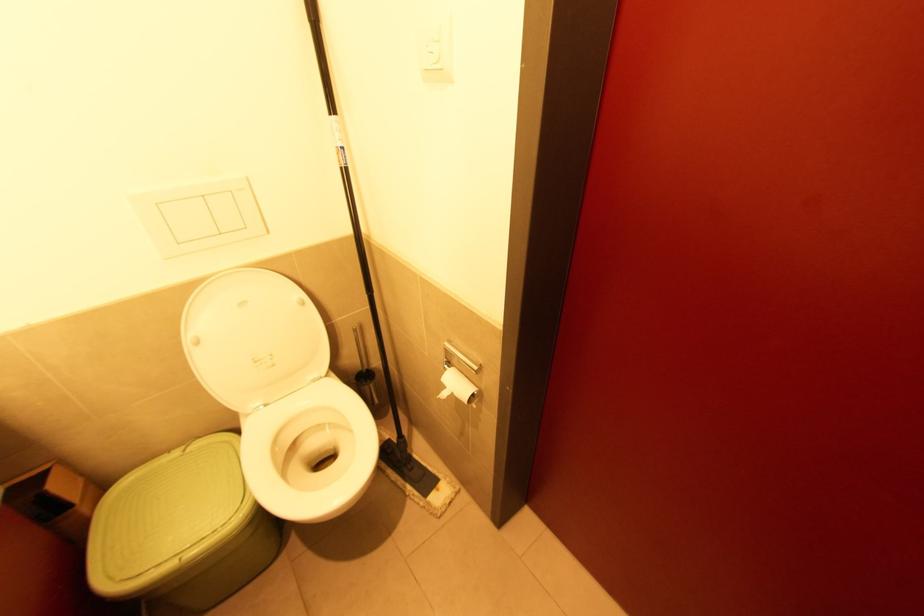
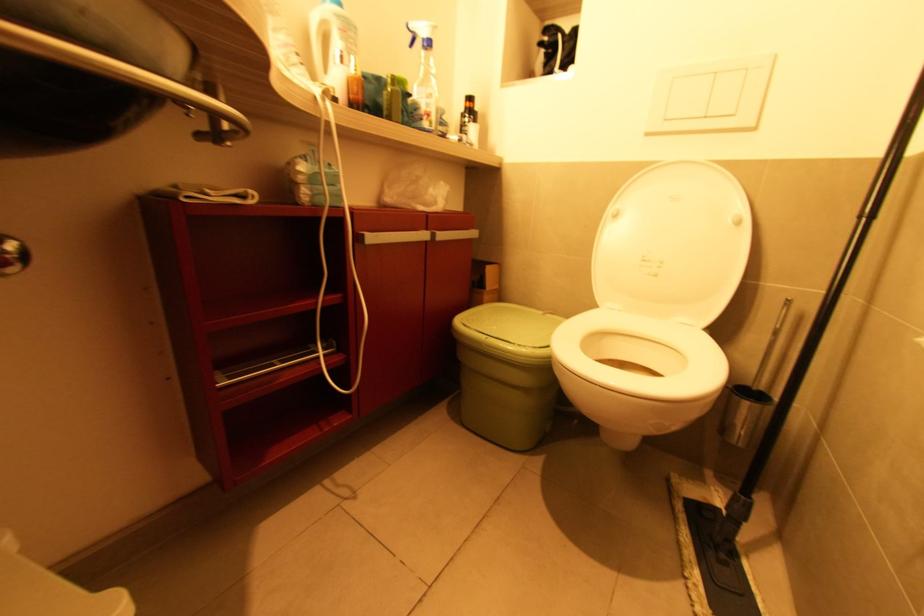
Where in the second image is the point corresponding to pixel 200 342 from the first image?

(617, 217)